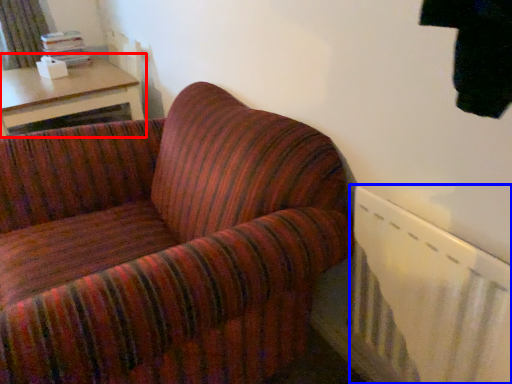
Question: Which point is closer to the camera, table (highlighted by a red box) or radiator (highlighted by a blue box)?

Choices:
 (A) table
 (B) radiator

Answer: (B)